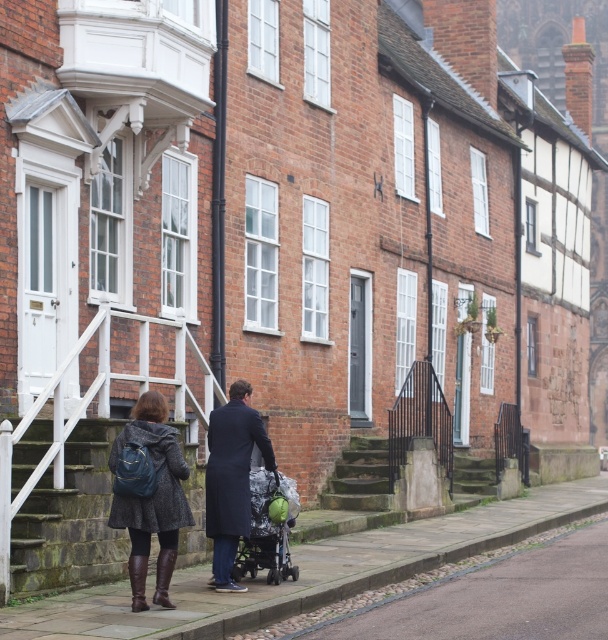
Question: Is dark blue wool coat at center below stone textured stairs at center?

Choices:
 (A) no
 (B) yes

Answer: (A)

Question: Is paved stone sidewalk at center positioned behind dark gray textured coat at center?

Choices:
 (A) yes
 (B) no

Answer: (B)

Question: Which point is farther to the camera?

Choices:
 (A) green fabric baby carriage at center
 (B) dark blue wool coat at center

Answer: (A)

Question: Does leather boots at lower left have a greater width compared to green mossy stone stairs at center?

Choices:
 (A) no
 (B) yes

Answer: (A)

Question: Among these points, which one is nearest to the camera?

Choices:
 (A) (482, 465)
 (B) (187, 490)
 (C) (240, 456)
 (D) (147, 444)

Answer: (D)

Question: Which point is closer to the camera taking this photo?

Choices:
 (A) (371, 493)
 (B) (308, 564)

Answer: (B)